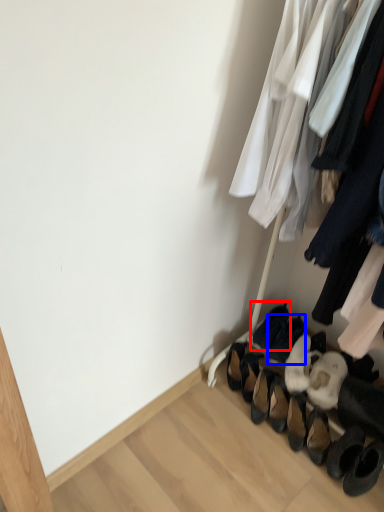
Question: Which object appears farthest to the camera in this image, footwear (highlighted by a red box) or footwear (highlighted by a blue box)?

Choices:
 (A) footwear
 (B) footwear

Answer: (A)